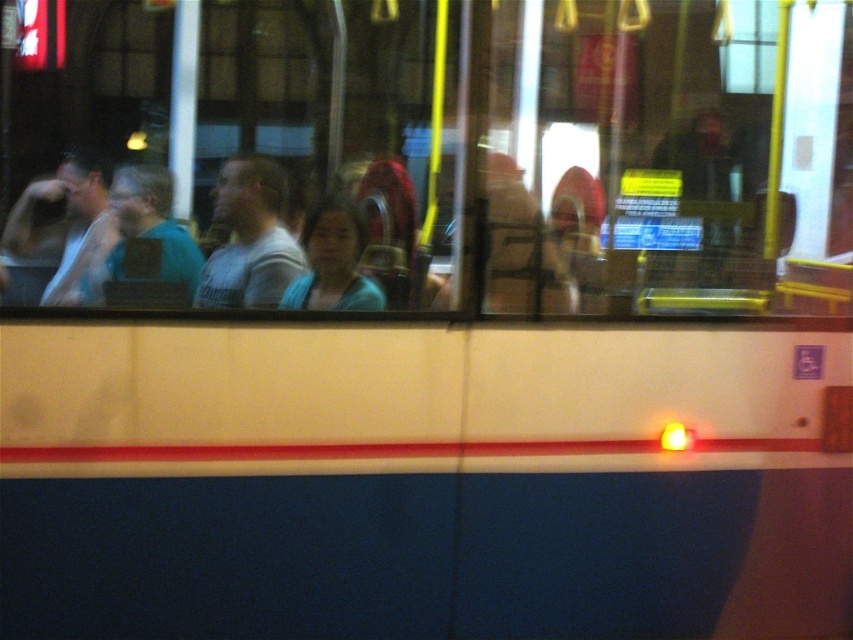
Question: Can you confirm if light blue shirt at center is smaller than matte green shirt at left?

Choices:
 (A) no
 (B) yes

Answer: (A)

Question: Estimate the real-world distances between objects in this image. Which object is farther from the matte blue shirt at center?

Choices:
 (A) light blue shirt at center
 (B) matte green shirt at left
 (C) white tank top at left

Answer: (C)

Question: Is light blue shirt at center bigger than white tank top at left?

Choices:
 (A) no
 (B) yes

Answer: (A)

Question: Considering the real-world distances, which object is closest to the matte blue shirt at center?

Choices:
 (A) matte green shirt at left
 (B) light blue shirt at center

Answer: (B)

Question: Does matte green shirt at left lie behind matte blue shirt at center?

Choices:
 (A) no
 (B) yes

Answer: (A)

Question: Which of the following is the closest to the observer?

Choices:
 (A) (242, 234)
 (B) (94, 269)
 (C) (315, 268)
 (D) (126, 294)

Answer: (B)